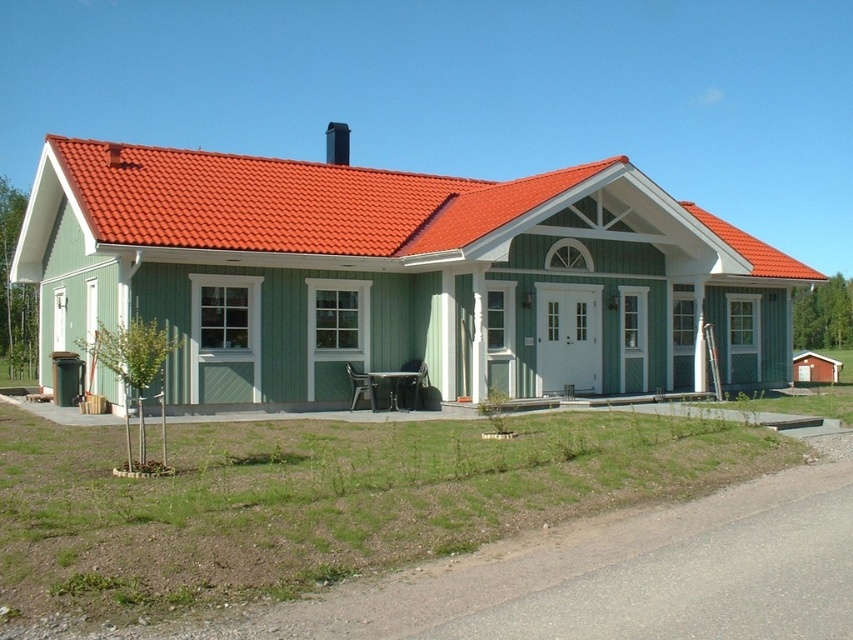
Who is more distant from viewer, (196, 230) or (346, 138)?

The point (346, 138) is behind.

Looking at this image, does red tile roof at upper center lie in front of black smooth chimney at upper center?

That is True.

Which is behind, point (286, 241) or point (326, 136)?

Positioned behind is point (326, 136).

Locate an element on the screen. The width and height of the screenshot is (853, 640). red tile roof at upper center is located at coordinates (291, 202).